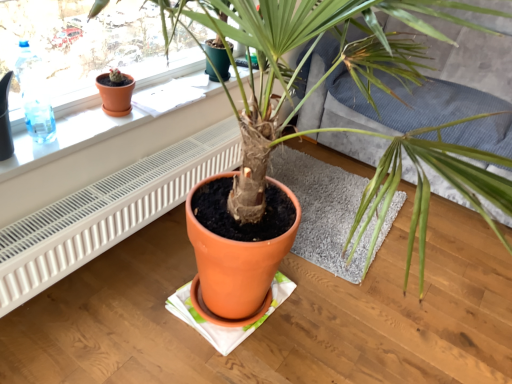
Find the location of a particular element. Image resolution: width=512 pixels, height=384 pixels. vacant point to the right of transparent plastic bottle at upper left is located at coordinates (81, 132).